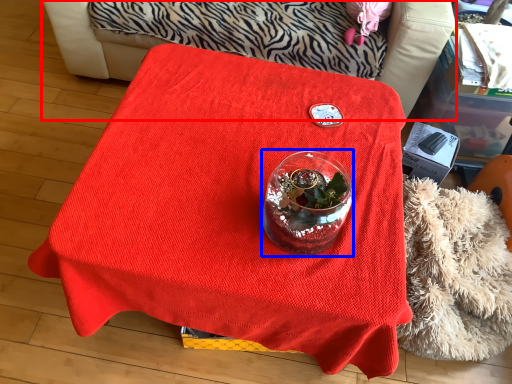
Question: Which object is further to the camera taking this photo, furniture (highlighted by a red box) or glass vase (highlighted by a blue box)?

Choices:
 (A) furniture
 (B) glass vase

Answer: (A)